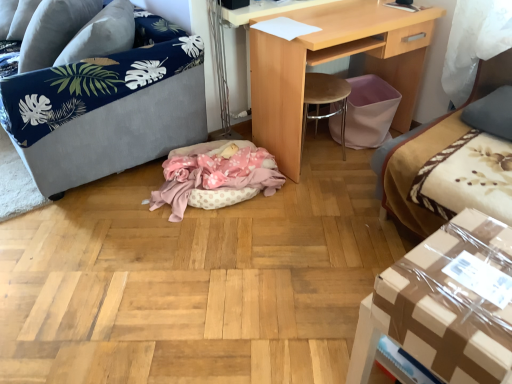
What do you see at coordinates (451, 115) in the screenshot? The image size is (512, 384). I see `velvet beige couch at right` at bounding box center [451, 115].

In order to face light wood desk at center, should I rotate leftwards or rightwards?

To face it directly, rotate right by 12.327 degrees.

Where is `light wood desk at center`? The height and width of the screenshot is (384, 512). light wood desk at center is located at coordinates (330, 60).

Measure the distance between gray fabric pillow at upper left, the second pillow from the bottom, and camera.

A distance of 7.28 feet exists between gray fabric pillow at upper left, the second pillow from the bottom, and camera.

The width and height of the screenshot is (512, 384). What are the coordinates of `gray fabric pillow at upper right, the first pillow ordered from the bottom` in the screenshot? It's located at (490, 113).

Considering the sizes of velvet grey sofa at left and pink polka dot fabric cat bed at center in the image, is velvet grey sofa at left wider or thinner than pink polka dot fabric cat bed at center?

Considering their sizes, velvet grey sofa at left looks broader than pink polka dot fabric cat bed at center.

Does velvet grey sofa at left have a larger size compared to pink polka dot fabric cat bed at center?

Correct, velvet grey sofa at left is larger in size than pink polka dot fabric cat bed at center.

Consider the image. Considering the relative positions of velvet grey sofa at left and pink polka dot fabric cat bed at center in the image provided, is velvet grey sofa at left to the left or to the right of pink polka dot fabric cat bed at center?

velvet grey sofa at left is to the left of pink polka dot fabric cat bed at center.

Is velvet beige couch at right facing away from pink polka dot fabric cat bed at center?

velvet beige couch at right is not turned away from pink polka dot fabric cat bed at center.

Considering the points (406, 191) and (248, 197), which point is in front, point (406, 191) or point (248, 197)?

Positioned in front is point (406, 191).

From the image's perspective, is velvet beige couch at right below pink polka dot fabric cat bed at center?

Actually, velvet beige couch at right appears above pink polka dot fabric cat bed at center in the image.

Can you tell me how much velvet beige couch at right and pink polka dot fabric cat bed at center differ in facing direction?

92 degrees separate the facing orientations of velvet beige couch at right and pink polka dot fabric cat bed at center.

Is light wood desk at center completely or partially inside velvet beige couch at right?

No, light wood desk at center is not a part of velvet beige couch at right.

Consider the image. Is velvet beige couch at right not close to light wood desk at center?

No, velvet beige couch at right is not far away from light wood desk at center.

Is velvet beige couch at right aimed at light wood desk at center?

No, velvet beige couch at right is not turned towards light wood desk at center.

Who is bigger, velvet beige couch at right or gray fabric pillow at upper right, the second pillow in the back-to-front sequence?

velvet beige couch at right is bigger.

Considering the relative positions of velvet beige couch at right and gray fabric pillow at upper right, marked as the second pillow in a top-to-bottom arrangement, in the image provided, is velvet beige couch at right to the right of gray fabric pillow at upper right, marked as the second pillow in a top-to-bottom arrangement, from the viewer's perspective?

Incorrect, velvet beige couch at right is not on the right side of gray fabric pillow at upper right, marked as the second pillow in a top-to-bottom arrangement.

Is velvet beige couch at right wider than gray fabric pillow at upper right, which is the second pillow from left to right?

Indeed, velvet beige couch at right has a greater width compared to gray fabric pillow at upper right, which is the second pillow from left to right.

In terms of height, does velvet beige couch at right look taller or shorter compared to gray fabric pillow at upper right, the first pillow ordered from the bottom?

Clearly, velvet beige couch at right is taller compared to gray fabric pillow at upper right, the first pillow ordered from the bottom.

Between gray fabric pillow at upper left, the second pillow in the front-to-back sequence, and velvet grey sofa at left, which one has more height?

velvet grey sofa at left is taller.

From the picture: Are gray fabric pillow at upper left, the 1th pillow in the top-to-bottom sequence, and velvet grey sofa at left beside each other?

No, gray fabric pillow at upper left, the 1th pillow in the top-to-bottom sequence, is not next to velvet grey sofa at left.

From a real-world perspective, is gray fabric pillow at upper left, the second pillow in the front-to-back sequence, located higher than velvet grey sofa at left?

Correct, in the physical world, gray fabric pillow at upper left, the second pillow in the front-to-back sequence, is higher than velvet grey sofa at left.

Where is `desk above the pink polka dot fabric cat bed at center (from the image's perspective)`? Image resolution: width=512 pixels, height=384 pixels. desk above the pink polka dot fabric cat bed at center (from the image's perspective) is located at coordinates (330, 60).

Which of these two, pink polka dot fabric cat bed at center or light wood desk at center, is thinner?

light wood desk at center is thinner.

Is pink polka dot fabric cat bed at center looking in the opposite direction of light wood desk at center?

pink polka dot fabric cat bed at center is not turned away from light wood desk at center.

From a real-world perspective, does pink polka dot fabric cat bed at center stand above light wood desk at center?

No, from a real-world perspective, pink polka dot fabric cat bed at center is not on top of light wood desk at center.

Which of these two, pink polka dot fabric cat bed at center or brown cardboard box at lower right, is thinner?

brown cardboard box at lower right.

Considering the sizes of objects pink polka dot fabric cat bed at center and brown cardboard box at lower right in the image provided, who is bigger, pink polka dot fabric cat bed at center or brown cardboard box at lower right?

With larger size is pink polka dot fabric cat bed at center.

Can you tell me how much pink polka dot fabric cat bed at center and brown cardboard box at lower right differ in facing direction?

175 degrees.

From a real-world perspective, relative to brown cardboard box at lower right, is pink polka dot fabric cat bed at center vertically above or below?

Clearly, from a real-world perspective, pink polka dot fabric cat bed at center is below brown cardboard box at lower right.

I want to click on furniture on the left of pink polka dot fabric cat bed at center, so click(106, 102).

You are a GUI agent. You are given a task and a screenshot of the screen. Output one action in this format:
    pyautogui.click(x=<x>, y=<y>)
    Task: Click on the studio couch above the pink polka dot fabric cat bed at center (from a real-world perspective)
    Image resolution: width=512 pixels, height=384 pixels.
    Given the screenshot: What is the action you would take?
    pyautogui.click(x=451, y=115)

Based on their spatial positions, is velvet grey sofa at left or gray fabric pillow at upper left, the 1th pillow in the top-to-bottom sequence, closer to gray fabric pillow at upper right, the second pillow in the back-to-front sequence?

velvet grey sofa at left.

Which object lies further to the anchor point pink polka dot fabric cat bed at center, gray fabric pillow at upper right, the first pillow ordered from the bottom, or gray fabric pillow at upper left, the second pillow in the front-to-back sequence?

gray fabric pillow at upper right, the first pillow ordered from the bottom, lies further to pink polka dot fabric cat bed at center than the other object.

From the image, which object appears to be nearer to light wood desk at center, velvet grey sofa at left or velvet beige couch at right?

Among the two, velvet beige couch at right is located nearer to light wood desk at center.

Looking at the image, which one is located closer to brown cardboard box at lower right, gray fabric pillow at upper right, the first pillow ordered from the bottom, or gray fabric pillow at upper left, the second pillow in the front-to-back sequence?

gray fabric pillow at upper right, the first pillow ordered from the bottom, is positioned closer to the anchor brown cardboard box at lower right.

From the image, which object appears to be farther from light wood desk at center, pink polka dot fabric cat bed at center or gray fabric pillow at upper right, the second pillow in the back-to-front sequence?

gray fabric pillow at upper right, the second pillow in the back-to-front sequence, is positioned further to the anchor light wood desk at center.

Estimate the real-world distances between objects in this image. Which object is further from pink polka dot fabric cat bed at center, gray fabric pillow at upper right, marked as the second pillow in a top-to-bottom arrangement, or velvet beige couch at right?

The object further to pink polka dot fabric cat bed at center is gray fabric pillow at upper right, marked as the second pillow in a top-to-bottom arrangement.

Which object lies nearer to the anchor point pink polka dot fabric cat bed at center, velvet grey sofa at left or light wood desk at center?

The object closer to pink polka dot fabric cat bed at center is velvet grey sofa at left.

Looking at this image, looking at the image, which one is located further to velvet grey sofa at left, light wood desk at center or pink polka dot fabric cat bed at center?

Based on the image, light wood desk at center appears to be further to velvet grey sofa at left.

You are a GUI agent. You are given a task and a screenshot of the screen. Output one action in this format:
    pyautogui.click(x=<x>, y=<y>)
    Task: Click on the table located between pink polka dot fabric cat bed at center and velvet beige couch at right in the left-right direction
    The height and width of the screenshot is (384, 512).
    Given the screenshot: What is the action you would take?
    pyautogui.click(x=444, y=306)

Locate an element on the screen. This screenshot has height=384, width=512. cat bed between velvet grey sofa at left and light wood desk at center from left to right is located at coordinates click(216, 176).

This screenshot has width=512, height=384. In order to click on studio couch located between velvet grey sofa at left and gray fabric pillow at upper right, which is the second pillow from left to right, in the left-right direction in this screenshot , I will do `click(451, 115)`.

This screenshot has height=384, width=512. I want to click on cat bed situated between velvet grey sofa at left and brown cardboard box at lower right from left to right, so 216,176.